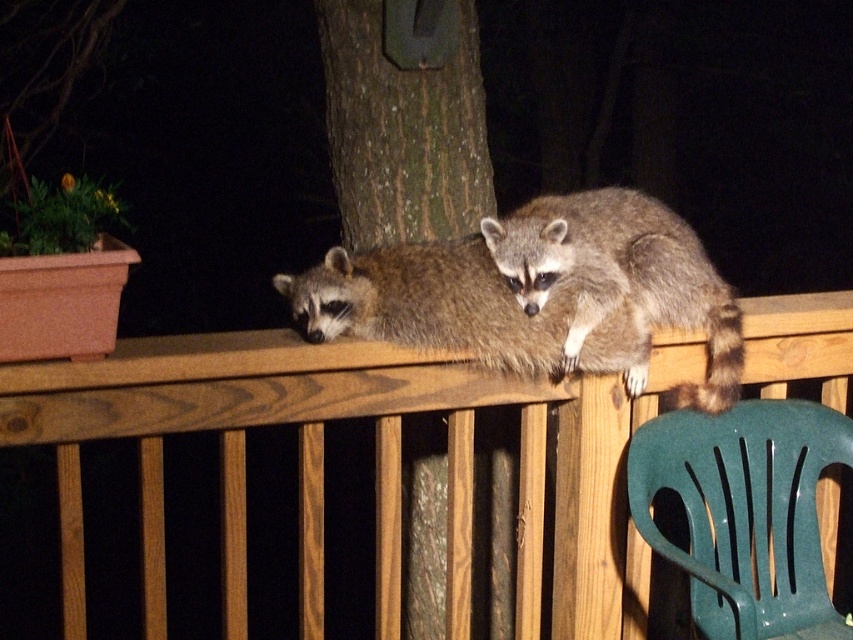
You are standing in front of the wooden deck railing where the two raccoons are resting. You want to place a small snack exactly at the point marked as point (x=552, y=216). If you can reach up to 2 meters, will you be able to reach that point?

The point (x=552, y=216) is 2.48 meters away from the camera, which is beyond your 2 meters reach. Therefore, you cannot reach the point.

You are standing on the wooden deck and want to place a small decorative item exactly at the point marked as point (x=374, y=461). According to the scene description, where will this item be placed?

The point (x=374, y=461) corresponds to the wooden rail at upper center, so the item will be placed on the wooden rail at upper center.

Looking at this image, you are a bird trying to land on the brown rough bark tree at center. Considering the size of the tree compared to the fuzzy brown raccoon at upper right, do you think the tree is wide enough for you to perch comfortably?

The brown rough bark tree at center is narrower than the fuzzy brown raccoon at upper right, so it may not be wide enough for the bird to perch comfortably.